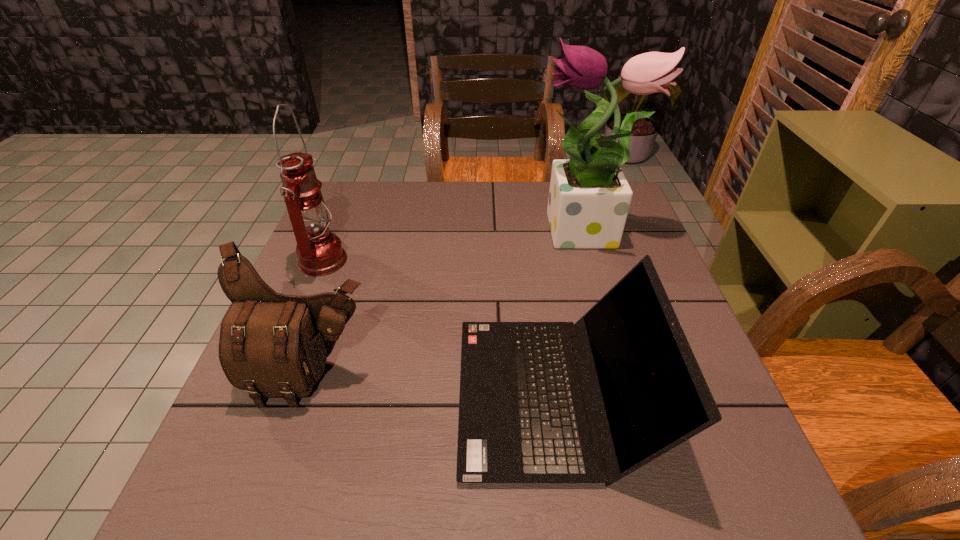
Image resolution: width=960 pixels, height=540 pixels. Find the location of `free spot between the shoulder bag and the flower arrangement`. free spot between the shoulder bag and the flower arrangement is located at coordinates (449, 305).

Identify the location of free space that is in between the tallest object and the third shortest object. (454, 248).

Identify the location of vacant point located between the second tallest object and the laptop computer. (439, 328).

You are a GUI agent. You are given a task and a screenshot of the screen. Output one action in this format:
    pyautogui.click(x=<x>, y=<y>)
    Task: Click on the unoccupied position between the oil lamp and the shortest object
    This screenshot has width=960, height=540.
    Given the screenshot: What is the action you would take?
    [439, 328]

Identify which object is the closest to the oil lamp. Please provide its 2D coordinates. Your answer should be formatted as a tuple, i.e. [(x, y)], where the tuple contains the x and y coordinates of a point satisfying the conditions above.

[(271, 345)]

This screenshot has width=960, height=540. Find the location of `object that is the closest to the shoulder bag`. object that is the closest to the shoulder bag is located at coordinates (524, 412).

Identify the location of free space that satisfies the following two spatial constraints: 1. on the front-facing side of the tallest object; 2. on the front-facing side of the shoulder bag. Image resolution: width=960 pixels, height=540 pixels. (628, 375).

Find the location of `free space that satisfies the following two spatial constraints: 1. on the front-facing side of the tallest object; 2. on the front-facing side of the second shortest object`. free space that satisfies the following two spatial constraints: 1. on the front-facing side of the tallest object; 2. on the front-facing side of the second shortest object is located at coordinates (628, 375).